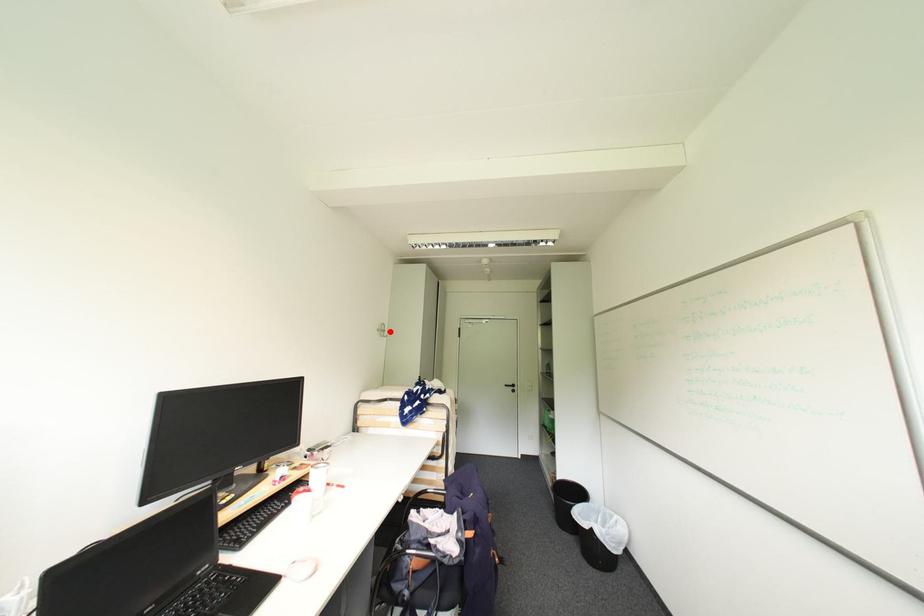
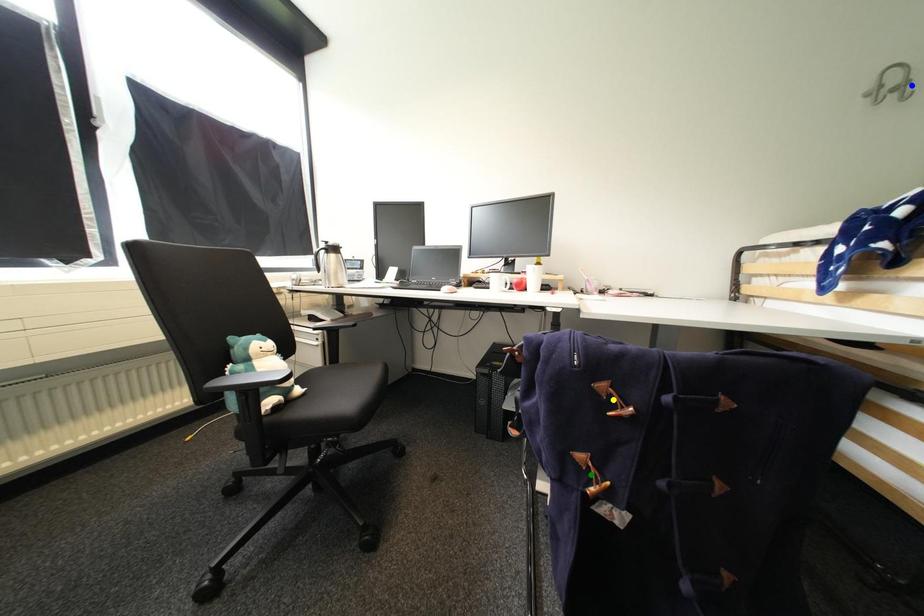
Question: I am providing you with two images of the same scene from different viewpoints. A red point is marked on the first image. You are given multiple points on the second image. Can you choose the point in image 2 that corresponds to the point in image 1?

Choices:
 (A) blue point
 (B) green point
 (C) yellow point

Answer: (A)